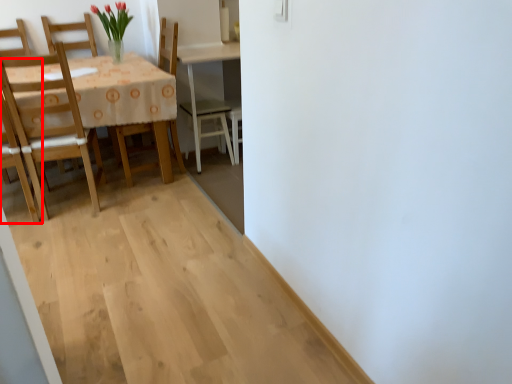
Question: Considering the relative positions of chair (annotated by the red box) and chair in the image provided, where is chair (annotated by the red box) located with respect to the staircase?

Choices:
 (A) left
 (B) right

Answer: (A)